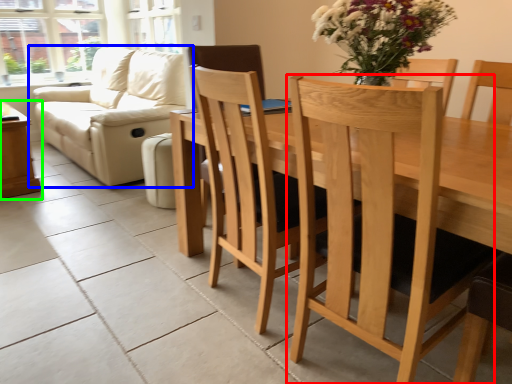
Question: Which object is the closest to the chair (highlighted by a red box)? Choose among these: studio couch (highlighted by a blue box) or table (highlighted by a green box).

Choices:
 (A) studio couch
 (B) table

Answer: (A)